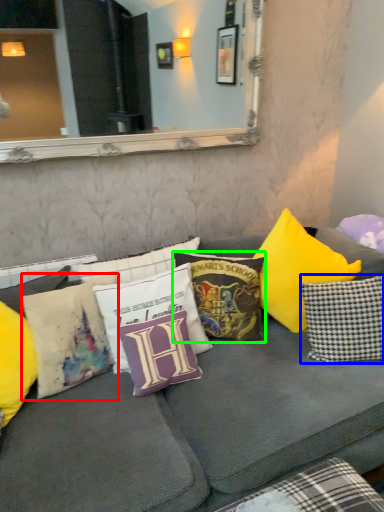
Question: Estimate the real-world distances between objects in this image. Which object is closer to pillow (highlighted by a red box), pillow (highlighted by a blue box) or pillow (highlighted by a green box)?

Choices:
 (A) pillow
 (B) pillow

Answer: (B)